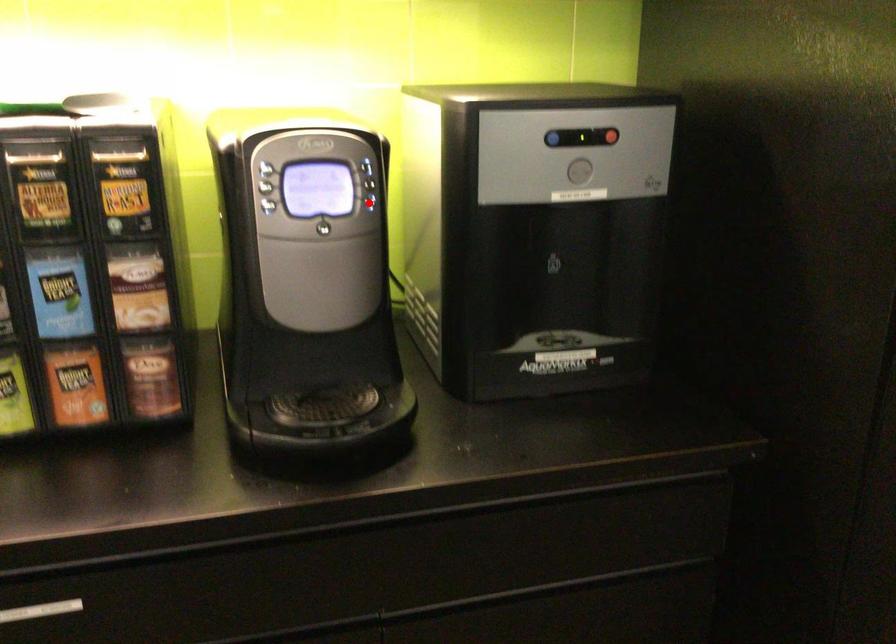
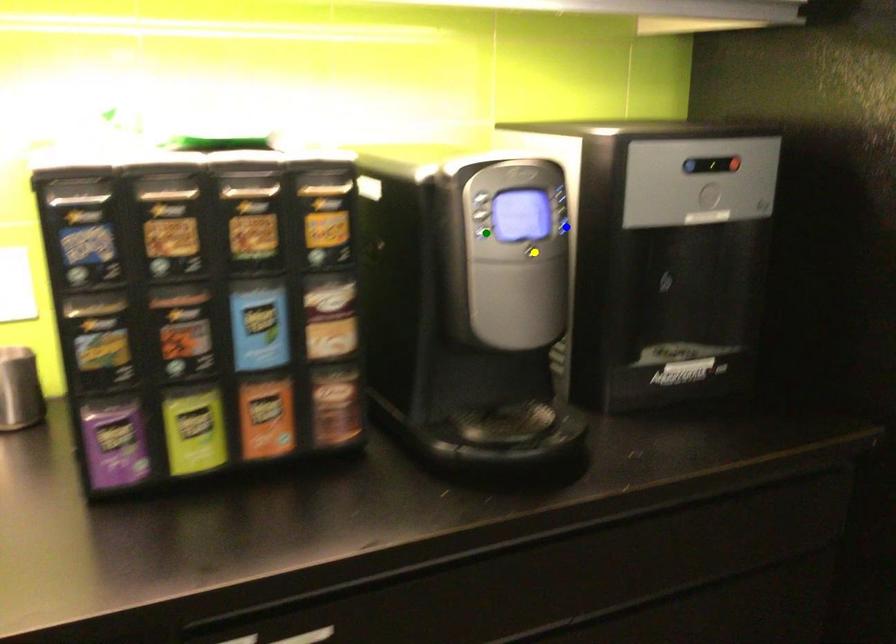
Question: I am providing you with two images of the same scene from different viewpoints. A red point is marked on the first image. You are given multiple points on the second image. In image 2, which mark is for the same physical point as the one in image 1?

Choices:
 (A) green point
 (B) blue point
 (C) yellow point

Answer: (B)